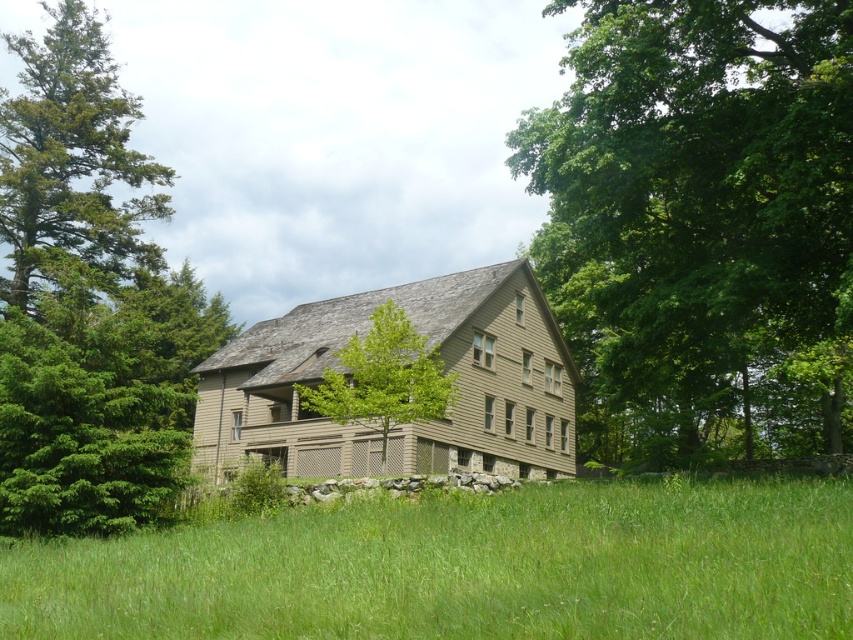
Question: Is green coniferous tree at left further to the viewer compared to green leafy tree at center?

Choices:
 (A) yes
 (B) no

Answer: (A)

Question: Does green grass at lower center have a larger size compared to green leafy tree at center?

Choices:
 (A) no
 (B) yes

Answer: (A)

Question: Based on their relative distances, which object is nearer to the green leafy tree at upper right?

Choices:
 (A) green coniferous tree at left
 (B) green leafy tree at center
 (C) green grass at lower center

Answer: (B)

Question: Which of the following is the farthest from the observer?

Choices:
 (A) (41, 451)
 (B) (439, 394)
 (C) (186, 589)

Answer: (B)

Question: Can you confirm if green leafy tree at upper right is thinner than green leafy tree at center?

Choices:
 (A) no
 (B) yes

Answer: (A)

Question: Which object appears closest to the camera in this image?

Choices:
 (A) green leafy tree at upper right
 (B) green grass at lower center
 (C) green leafy tree at left
 (D) green coniferous tree at left

Answer: (B)